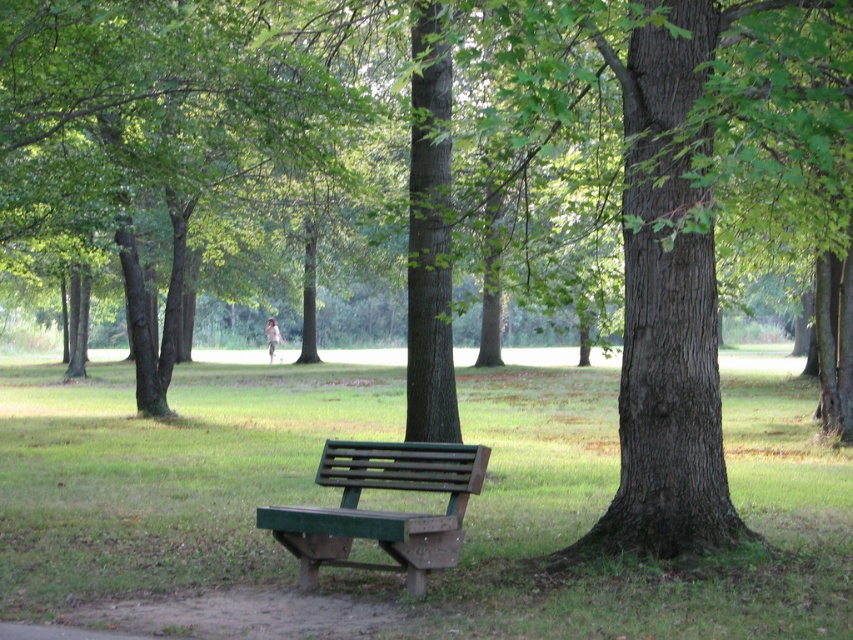
Question: Which point is closer to the camera taking this photo?

Choices:
 (A) (732, 456)
 (B) (473, 444)
 (C) (167, 365)

Answer: (B)

Question: Which point is closer to the camera taking this photo?

Choices:
 (A) tap(178, 96)
 (B) tap(293, 442)

Answer: (A)

Question: Can you confirm if green leafy tree at center is positioned below green wood bench at lower center?

Choices:
 (A) no
 (B) yes

Answer: (A)

Question: Considering the real-world distances, which object is farthest from the green grass at center?

Choices:
 (A) green leafy tree at center
 (B) green wood bench at lower center

Answer: (B)

Question: Is green leafy tree at center smaller than green wood bench at lower center?

Choices:
 (A) no
 (B) yes

Answer: (A)

Question: Is green grass at center thinner than green wood bench at lower center?

Choices:
 (A) yes
 (B) no

Answer: (B)